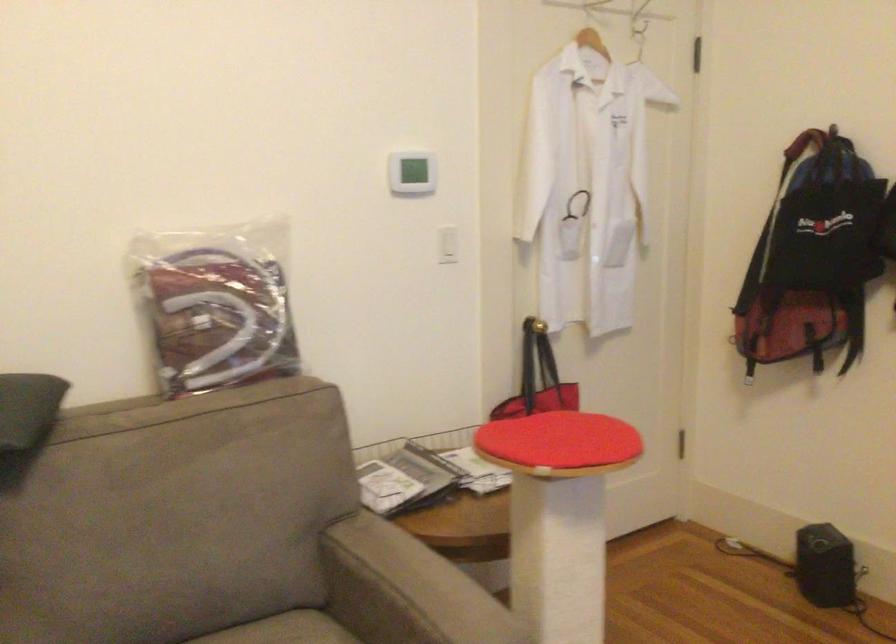
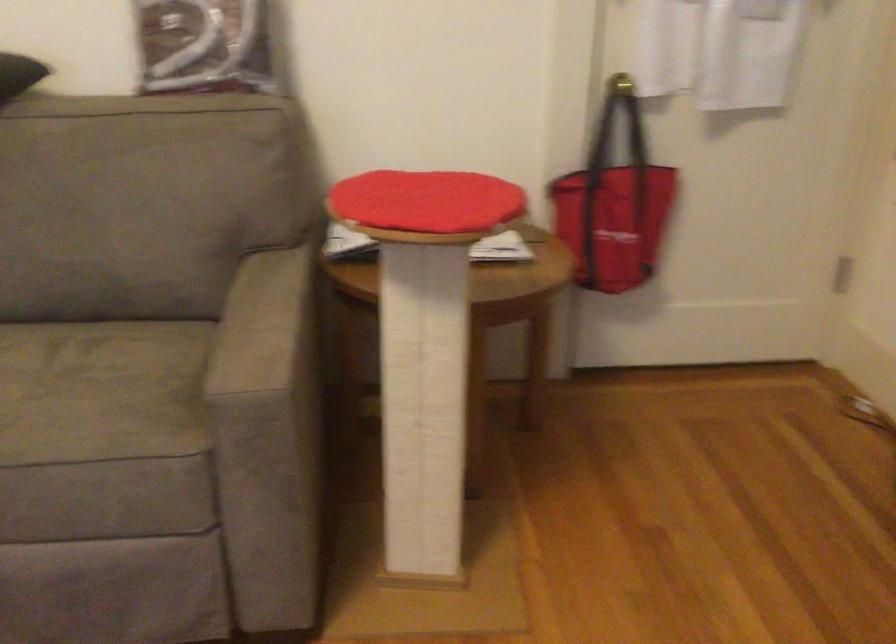
Find the pixel in the second image that matches the point at 537,325 in the first image.

(619, 84)